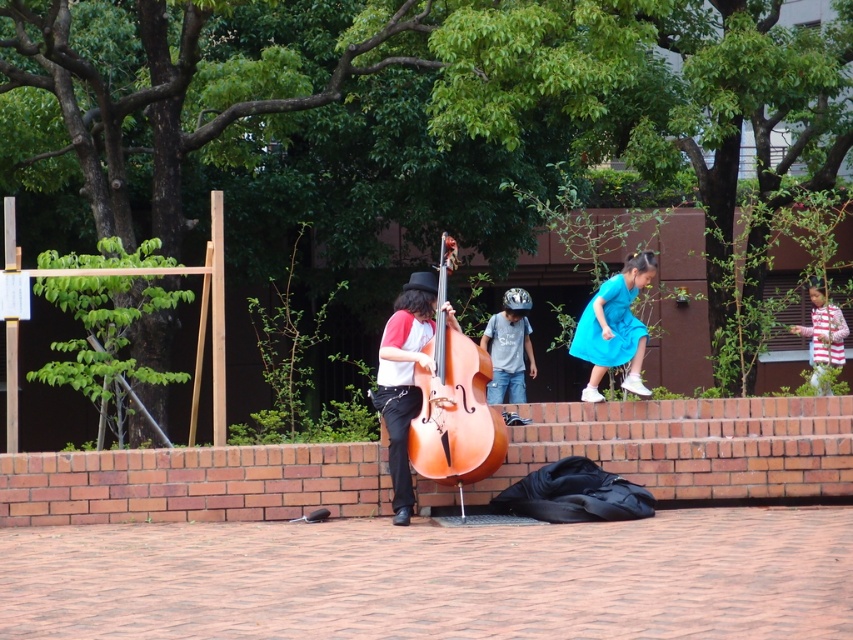
You are a photographer standing in the park and want to take a photo of the matte brown cello at center and the striped cotton shirt at right. Which object should you focus on first to ensure both are in the frame?

You should focus on the matte brown cello at center first because it is in front of the striped cotton shirt at right, so positioning the camera to include both would require starting with the closer object.

You are a photographer setting up a tripod in the park. You want to capture both the wooden polished cello at center and the matte blue dress at upper right in the same frame. Based on their positions, which object is wider and might require more space in the composition?

The wooden polished cello at center might be wider than the matte blue dress at upper right, so it requires more space in the composition.